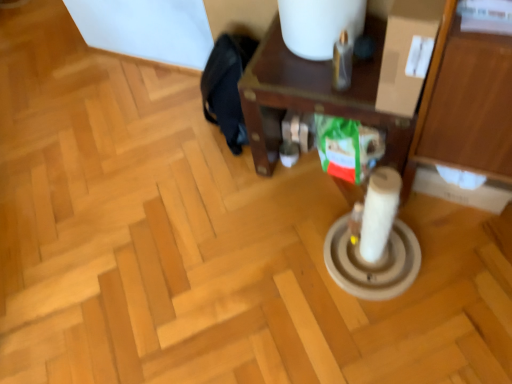
Question: Should I look upward or downward to see brown wooden side table at center?

Choices:
 (A) down
 (B) up

Answer: (B)